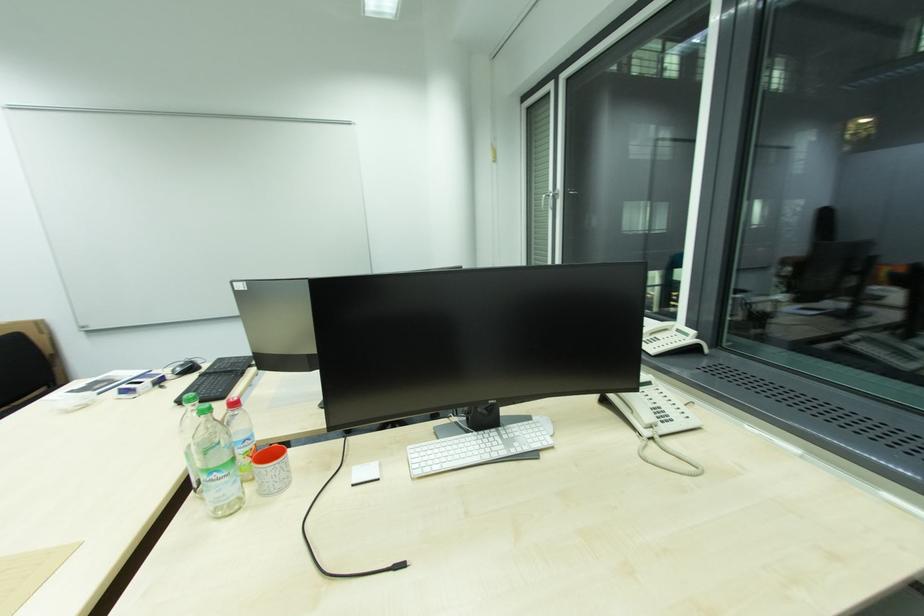
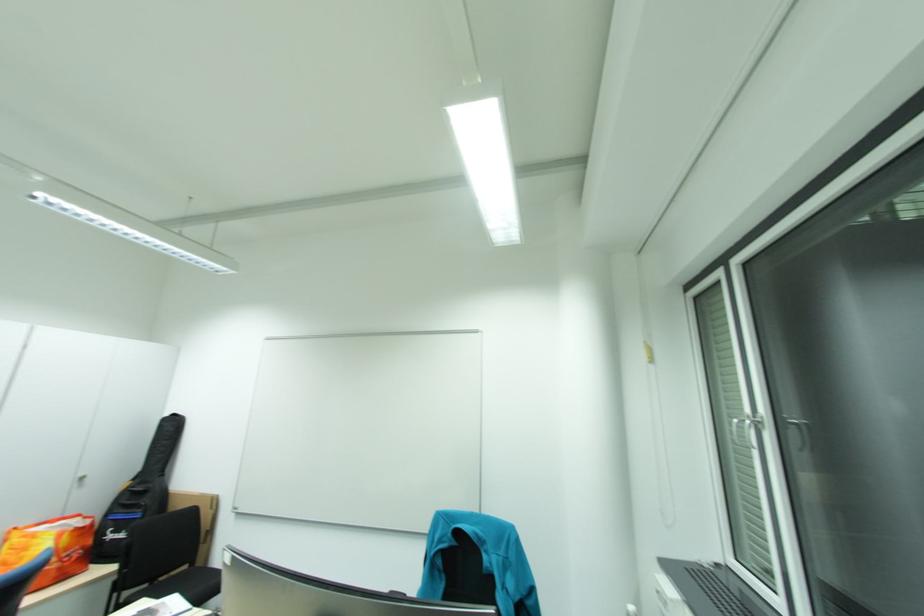
Looking at this image, how did the camera likely rotate?

The camera rotated toward left-up.